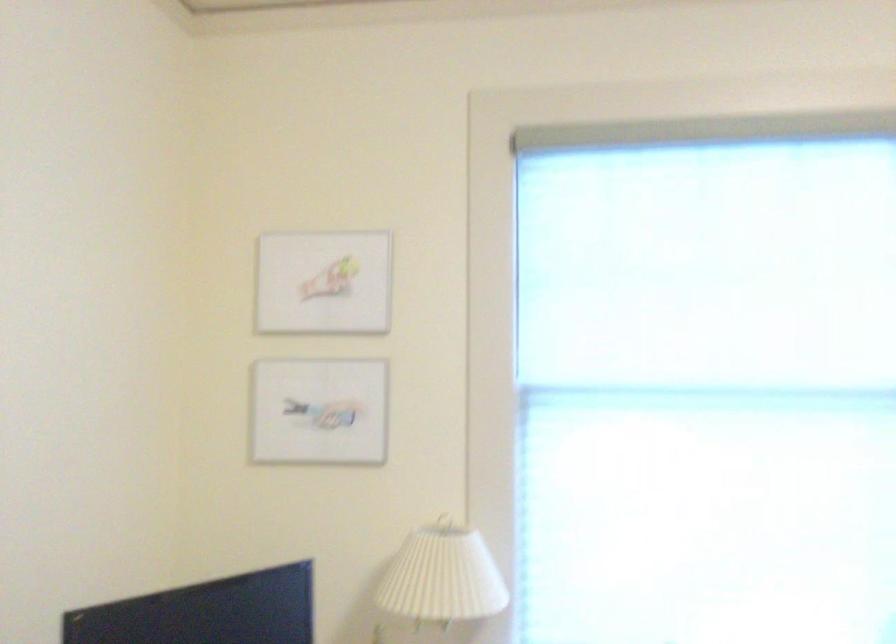
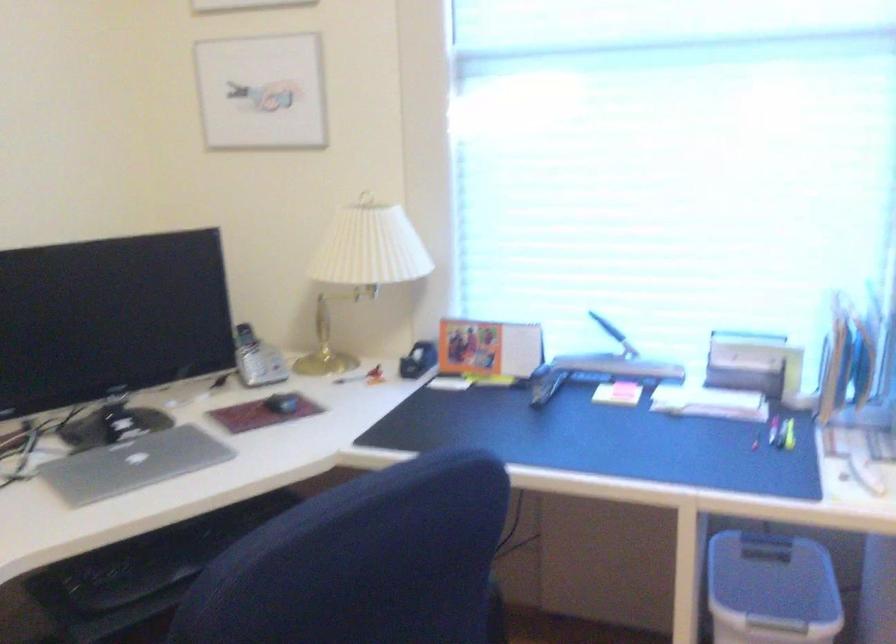
Question: The images are taken continuously from a first-person perspective. In which direction is your viewpoint rotating?

Choices:
 (A) Left
 (B) Right
 (C) Up
 (D) Down

Answer: (D)